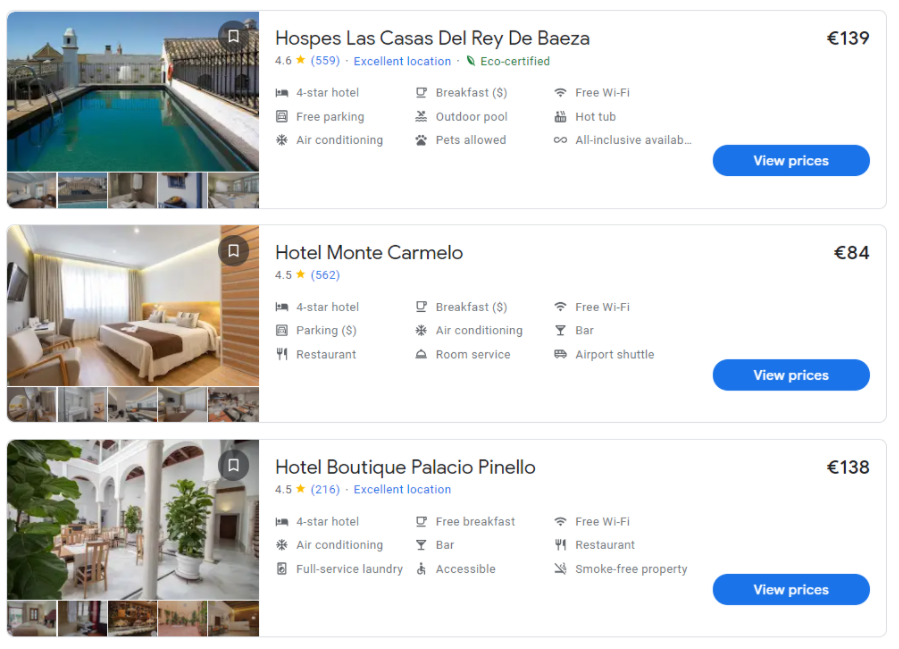
Where is `chair`? The image size is (899, 649). chair is located at coordinates (50, 361).